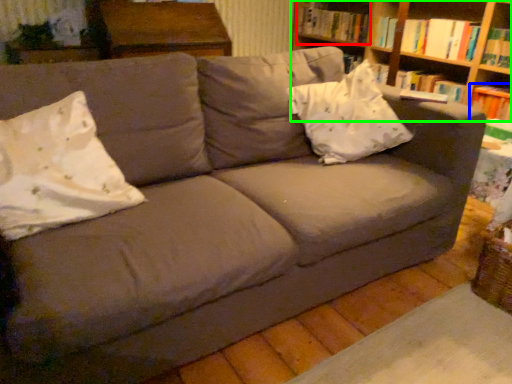
Question: Considering the real-world distances, which object is closest to book (highlighted by a red box)? paperback book (highlighted by a blue box) or shelf (highlighted by a green box).

Choices:
 (A) paperback book
 (B) shelf

Answer: (B)